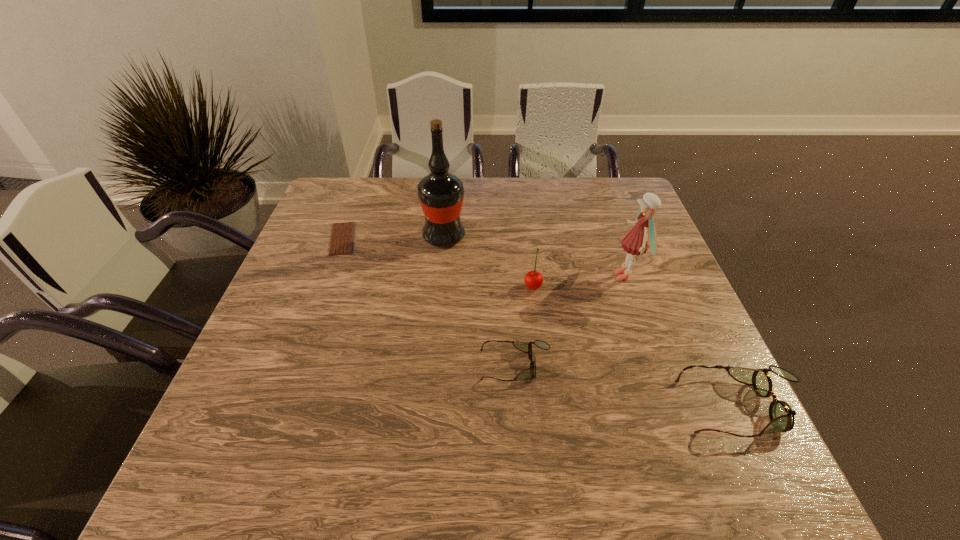
At what (x,y) coordinates should I click in order to perform the action: click on the left spectacles. Please return your answer as a coordinate pair (x, y). Looking at the image, I should click on (526, 347).

I want to click on the shorter spectacles, so click(526, 347).

Find the location of `the taller spectacles`. the taller spectacles is located at coordinates (781, 415).

The width and height of the screenshot is (960, 540). I want to click on the right spectacles, so click(781, 415).

Locate an element on the screen. the second tallest object is located at coordinates (636, 241).

Locate an element on the screen. This screenshot has height=540, width=960. the shortest object is located at coordinates (341, 243).

Where is `chocolate bar`? This screenshot has width=960, height=540. chocolate bar is located at coordinates (341, 243).

This screenshot has width=960, height=540. What are the coordinates of `the tallest object` in the screenshot? It's located at (441, 194).

I want to click on the second object from left to right, so click(441, 194).

I want to click on the fourth shortest object, so 533,280.